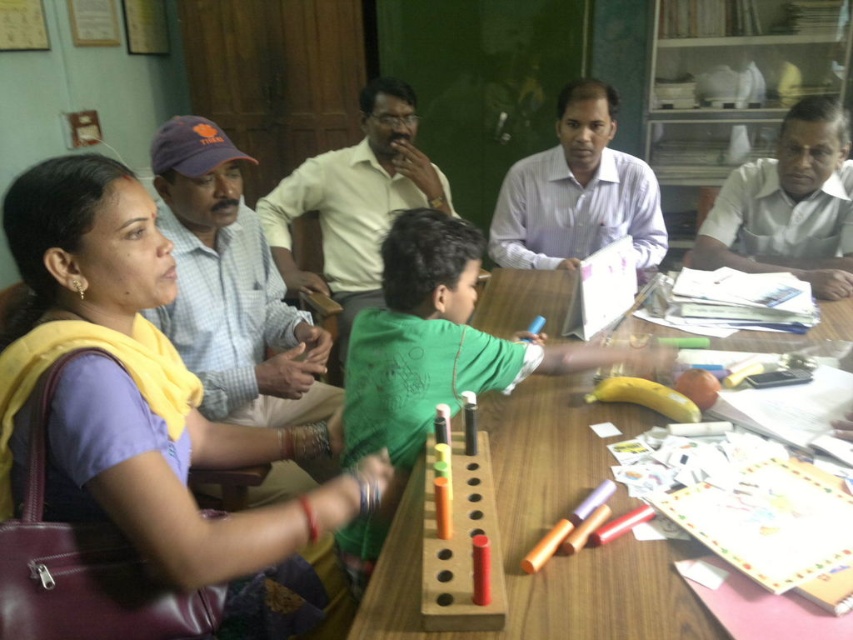
The height and width of the screenshot is (640, 853). Describe the element at coordinates (355, 202) in the screenshot. I see `light yellow shirt at center` at that location.

Which is above, light yellow shirt at center or white glossy shirt at upper right?

Positioned higher is light yellow shirt at center.

The height and width of the screenshot is (640, 853). What do you see at coordinates (355, 202) in the screenshot?
I see `light yellow shirt at center` at bounding box center [355, 202].

Locate an element on the screen. The width and height of the screenshot is (853, 640). light yellow shirt at center is located at coordinates (355, 202).

Between light blue shirt at left and white glossy shirt at upper right, which one appears on the right side from the viewer's perspective?

From the viewer's perspective, white glossy shirt at upper right appears more on the right side.

Can you confirm if light blue shirt at left is wider than white glossy shirt at upper right?

In fact, light blue shirt at left might be narrower than white glossy shirt at upper right.

This screenshot has height=640, width=853. In order to click on light blue shirt at left in this screenshot , I will do `click(231, 289)`.

Does point (146, 300) come behind point (796, 125)?

No, (146, 300) is in front of (796, 125).

Is point (265, 525) closer to camera compared to point (799, 193)?

That is True.

The image size is (853, 640). I want to click on matte yellow scarf at upper left, so click(x=148, y=406).